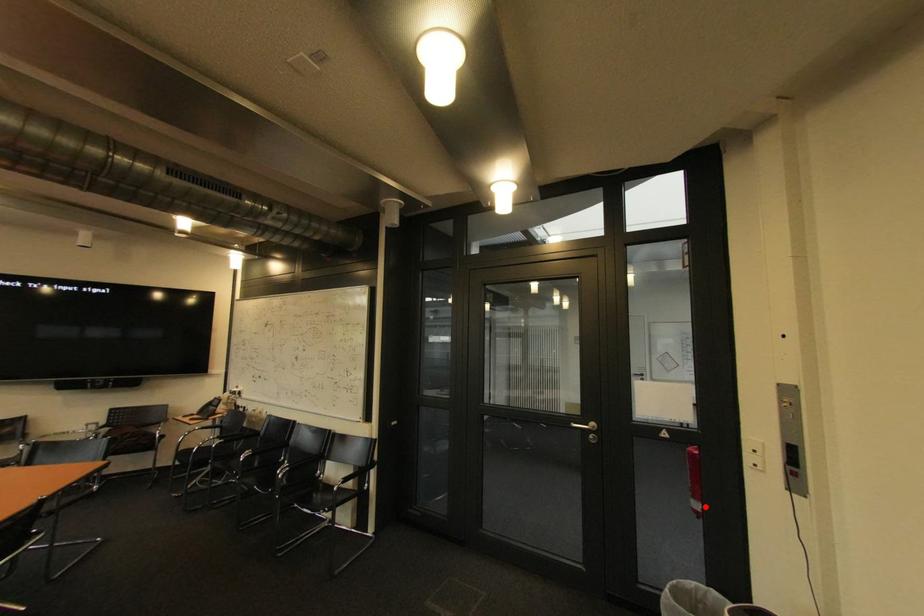
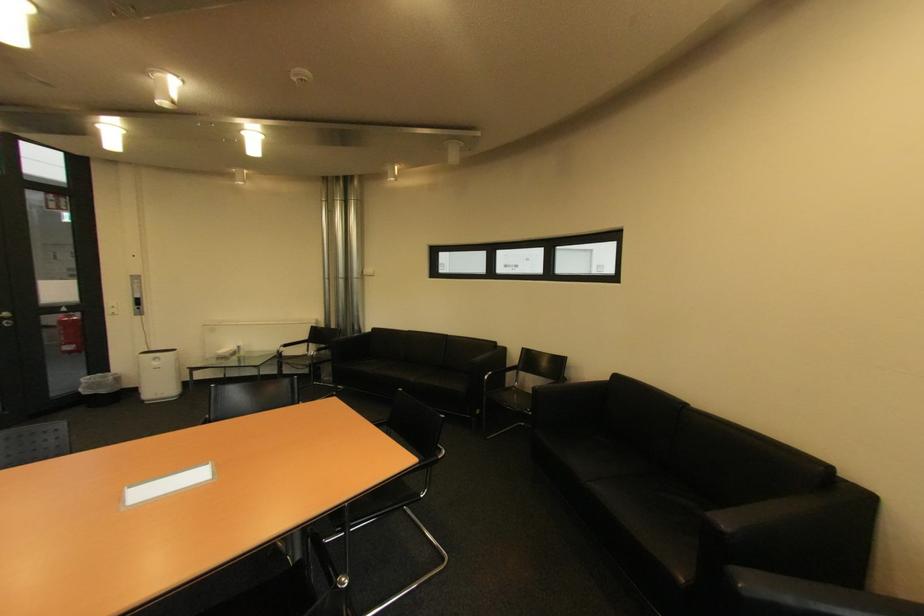
Where in the second image is the point corresponding to the highlighted location from the first image?

(79, 349)